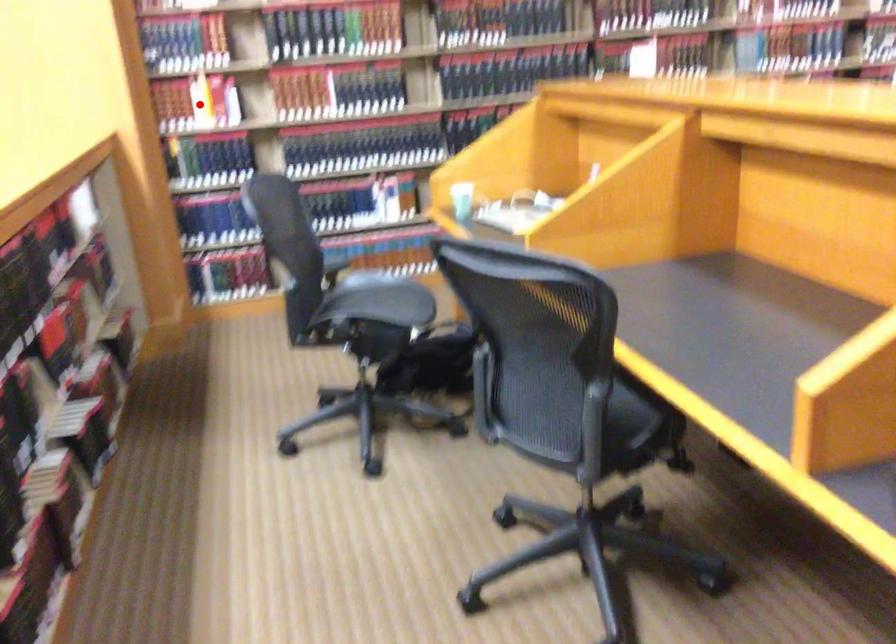
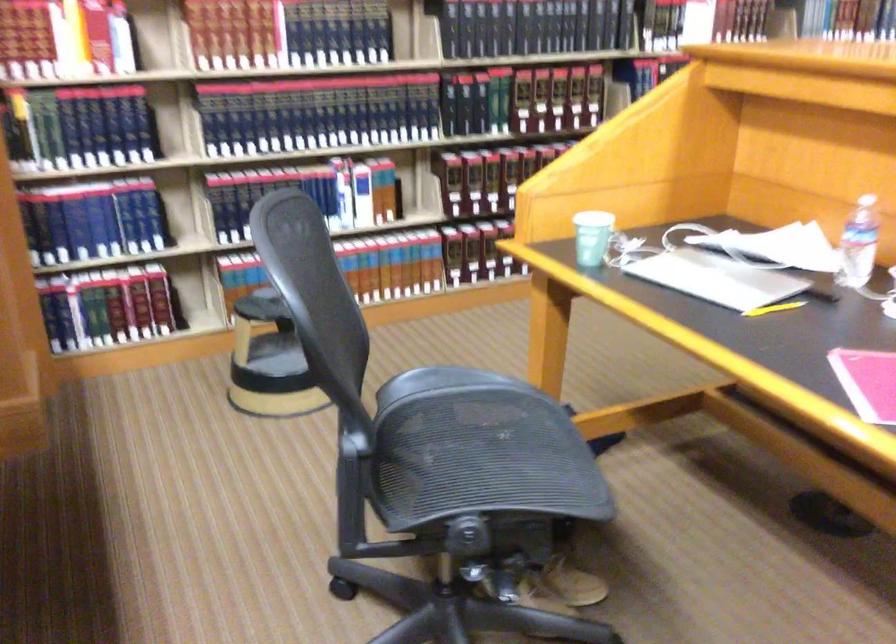
Where in the second image is the point corresponding to the highlighted location from the first image?

(64, 39)